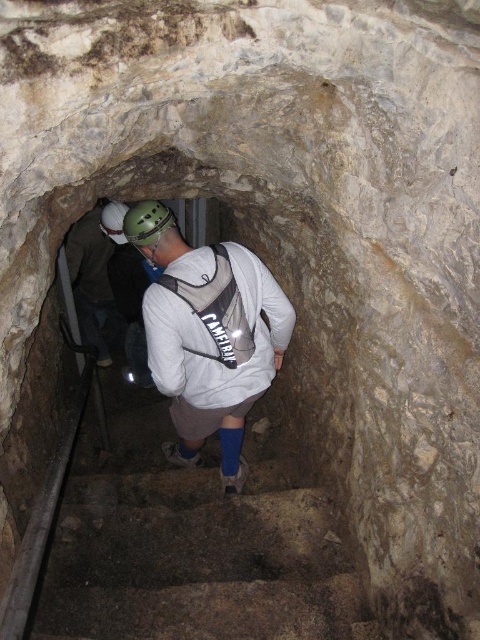
You are a hiker with a height of 5 feet 6 inches. You are standing at the bottom of the brown stone stairs at center and want to reach the green matte helmet at upper center. Can you safely climb the stairs to get to the helmet?

The brown stone stairs at center is 6.60 feet from the green matte helmet at upper center. Since you are 5 feet 6 inches tall, you can safely climb the stairs to reach the green matte helmet at upper center as the distance is within a manageable range for a hiker of your height.

You are planning to carry both the white matte backpack at center and the green matte helmet at upper center through the narrow rocky tunnel. Considering their sizes, which one might be more challenging to maneuver through tight spaces?

The white matte backpack at center has a larger size compared to the green matte helmet at upper center, so it might be more challenging to maneuver through tight spaces.

You are a tour guide leading a group through the tunnel. You notice the white matte backpack at center and the green matte helmet at upper center. If the distance between them is crucial for safety, can a 1.5 meter long safety rope connect them securely?

The white matte backpack at center is 1.42 meters away from the green matte helmet at upper center. Since the safety rope is 1.5 meters long, it can comfortably connect them securely with some slack remaining.